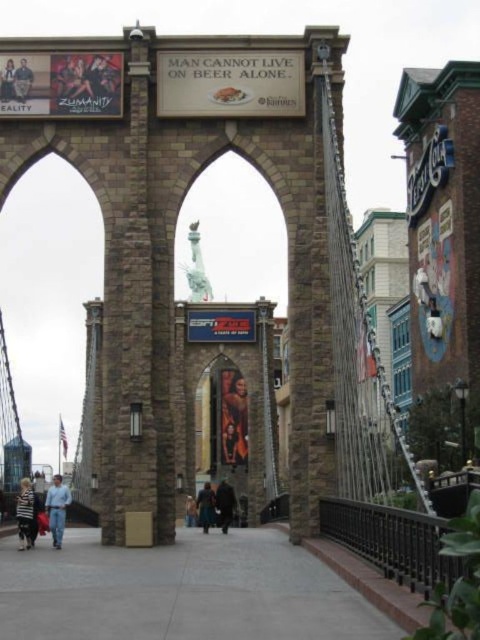
You are a photographer trying to capture both the striped fabric jacket at lower left and the smooth skin face at upper left in one frame. Which object should you focus on first to ensure both are in the frame?

You should focus on the striped fabric jacket at lower left first because it is larger and will require more space in the frame, ensuring the smaller smooth skin face at upper left can also be included.

Consider the image. You are standing on the gray concrete pavement at center. Can you see the Statue of Liberty from your current position?

Yes, the Statue of Liberty is faintly visible in the background through one of the arches of the bridge structure.

You are standing on the gray concrete pavement at center and want to reach the dark brown leather coat at center. Which direction should you move to get closer to the coat?

Since the gray concrete pavement at center is closer to the viewer than the dark brown leather coat at center, you should move backward to get closer to the coat.